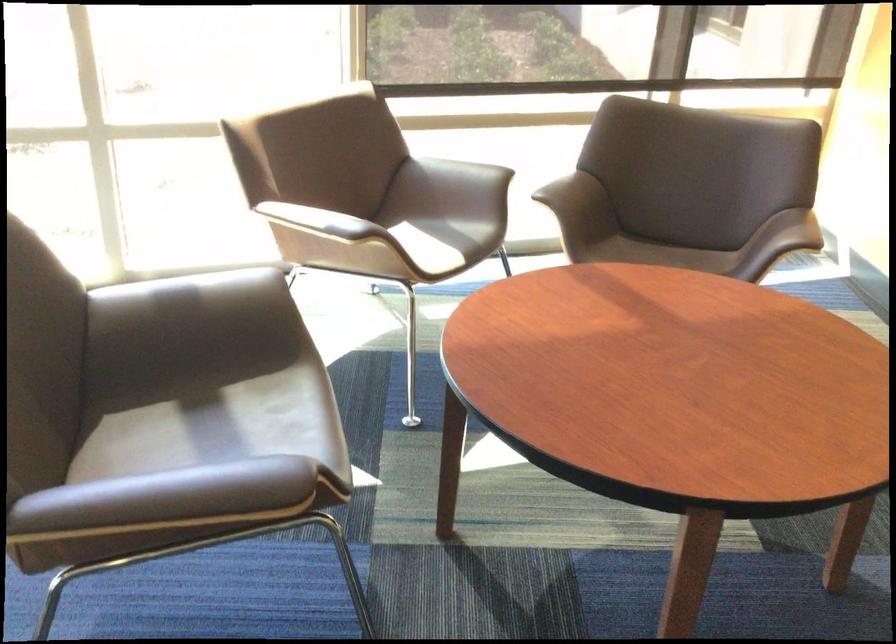
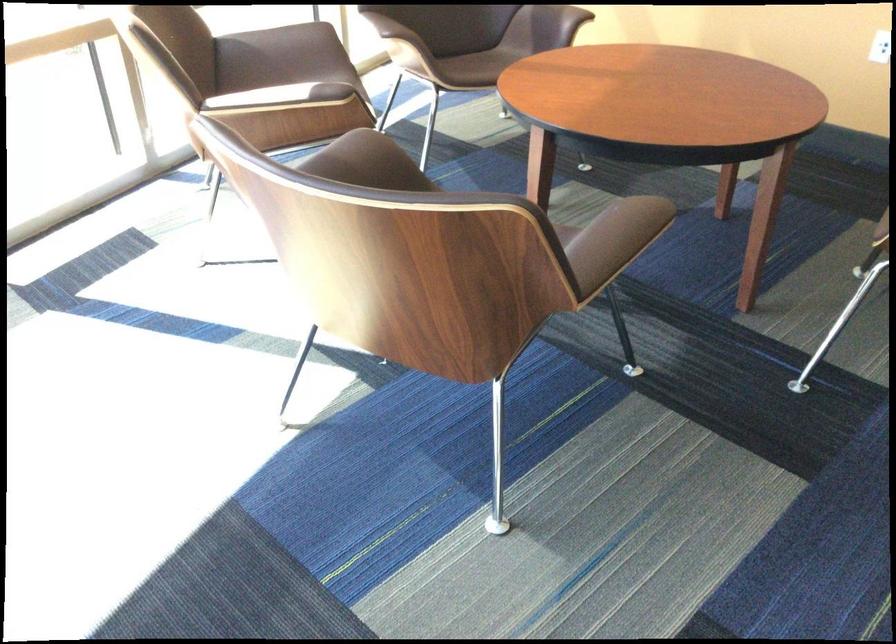
Question: I am providing you with two images of the same scene from different viewpoints. After the viewpoint changes to image2, which objects are now occluded?

Choices:
 (A) brown chair sitting surface
 (B) chair sitting surface
 (C) brown chair armrest
 (D) small metal weight

Answer: (B)